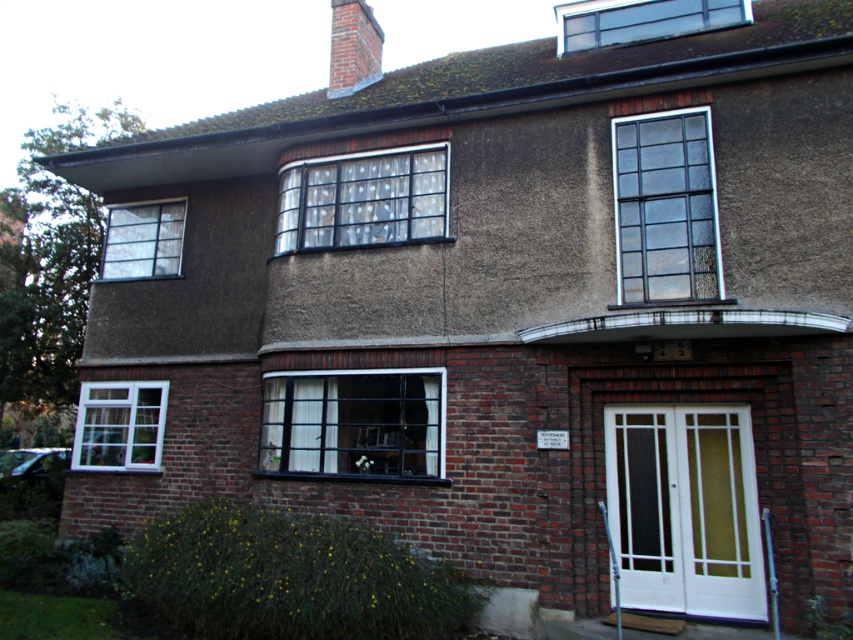
Question: Is clear glass skylight at upper center in front of clear glass window at upper left?

Choices:
 (A) yes
 (B) no

Answer: (A)

Question: Which object is the farthest from the white glass window at center?

Choices:
 (A) clear glass window at upper left
 (B) white plastic window at lower left

Answer: (A)

Question: Estimate the real-world distances between objects in this image. Which object is closer to the white plastic window at lower left?

Choices:
 (A) clear glass window at upper left
 (B) clear glass window at center
 (C) clear glass skylight at upper center

Answer: (A)

Question: Does clear glass window at upper center appear under clear glass skylight at upper center?

Choices:
 (A) no
 (B) yes

Answer: (B)

Question: Does clear glass skylight at upper center lie in front of clear glass window at upper left?

Choices:
 (A) yes
 (B) no

Answer: (A)

Question: Which point is farther to the camera?

Choices:
 (A) (695, 22)
 (B) (74, 445)
 (C) (624, 262)

Answer: (B)